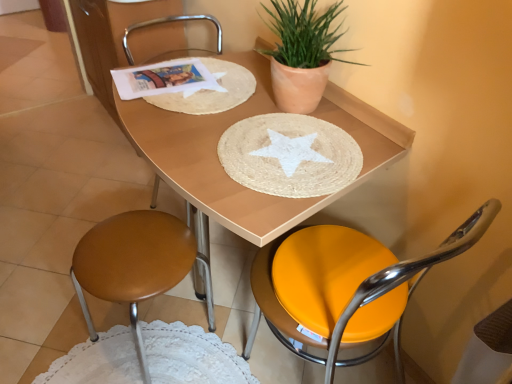
Locate an element on the screen. The image size is (512, 384). empty space that is ontop of natural fiber placemat at center, the 2th paper plate when ordered from top to bottom is located at coordinates (293, 150).